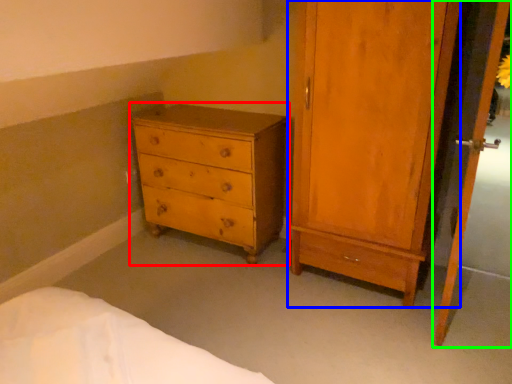
Question: Which object is the closest to the chest of drawers (highlighted by a red box)? Choose among these: door (highlighted by a blue box) or screen door (highlighted by a green box).

Choices:
 (A) door
 (B) screen door

Answer: (A)